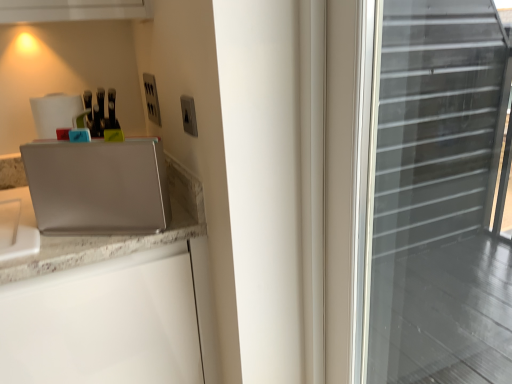
Question: In the image, is satin silver laptop at left positioned in front of or behind satin silver outlet at upper center, positioned as the 1th electric outlet in back-to-front order?

Choices:
 (A) front
 (B) behind

Answer: (A)

Question: From a real-world perspective, is satin silver laptop at left positioned above or below satin silver outlet at upper center, positioned as the 1th electric outlet in back-to-front order?

Choices:
 (A) below
 (B) above

Answer: (A)

Question: Which object is positioned farthest from the satin silver outlet at upper center, which is the 2th electric outlet from right to left?

Choices:
 (A) satin silver switch at upper center, the first electric outlet in the front-to-back sequence
 (B) satin silver laptop at left

Answer: (B)

Question: Which of these objects is positioned farthest from the satin silver switch at upper center, which is the 2th electric outlet from back to front?

Choices:
 (A) satin silver laptop at left
 (B) satin silver outlet at upper center, placed as the 1th electric outlet when sorted from left to right

Answer: (B)